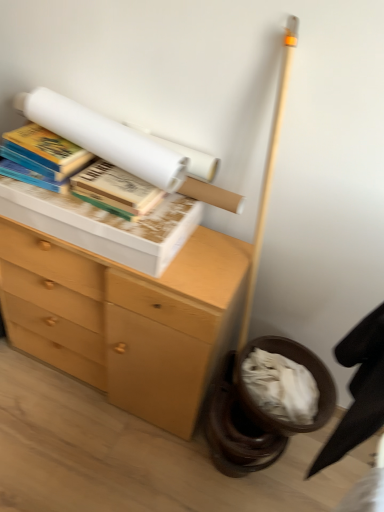
You are a GUI agent. You are given a task and a screenshot of the screen. Output one action in this format:
    pyautogui.click(x=<x>, y=<y>)
    Task: Click on the free point in front of hardcover book at upper left, the 1th book from the right
    Image resolution: width=384 pixels, height=512 pixels.
    Given the screenshot: What is the action you would take?
    pyautogui.click(x=113, y=225)